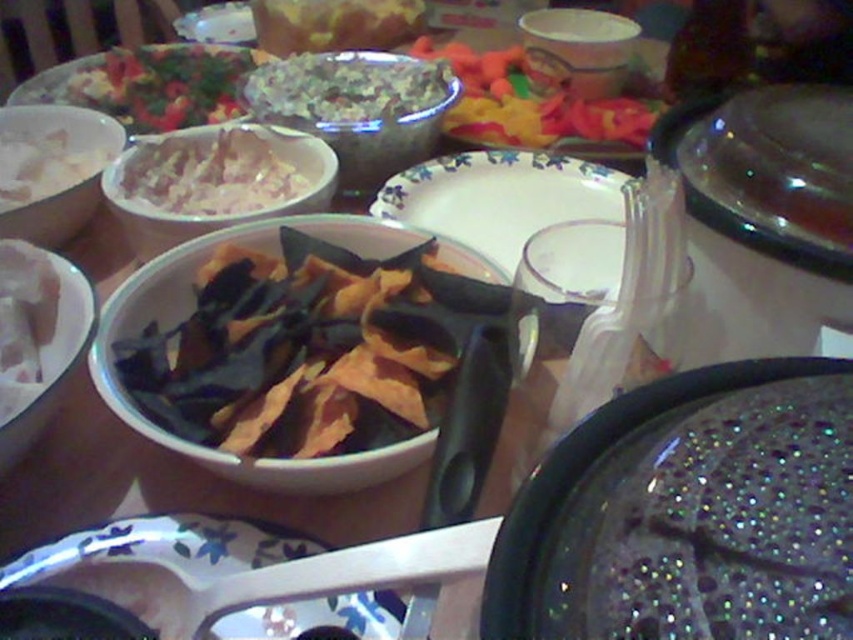
Question: Considering the real-world distances, which object is closest to the translucent glass bowl at center?

Choices:
 (A) white matte bowl at left
 (B) shiny plastic chips at center
 (C) matte white bowl at upper center

Answer: (B)

Question: Can you confirm if porcelain floral plate at center is wider than white floral plate at center?

Choices:
 (A) yes
 (B) no

Answer: (B)

Question: Which object is farther from the camera taking this photo?

Choices:
 (A) matte white bowl at upper center
 (B) green leafy salad at center

Answer: (A)

Question: Which of the following is the farthest from the observer?

Choices:
 (A) porcelain floral plate at center
 (B) white matte bowl at upper left
 (C) white floral plate at center

Answer: (C)

Question: Can you confirm if matte ceramic bowl at center is smaller than white matte bowl at upper left?

Choices:
 (A) yes
 (B) no

Answer: (B)

Question: Observing the image, what is the correct spatial positioning of white floral plate at center in reference to matte white bowl at upper center?

Choices:
 (A) above
 (B) below

Answer: (B)